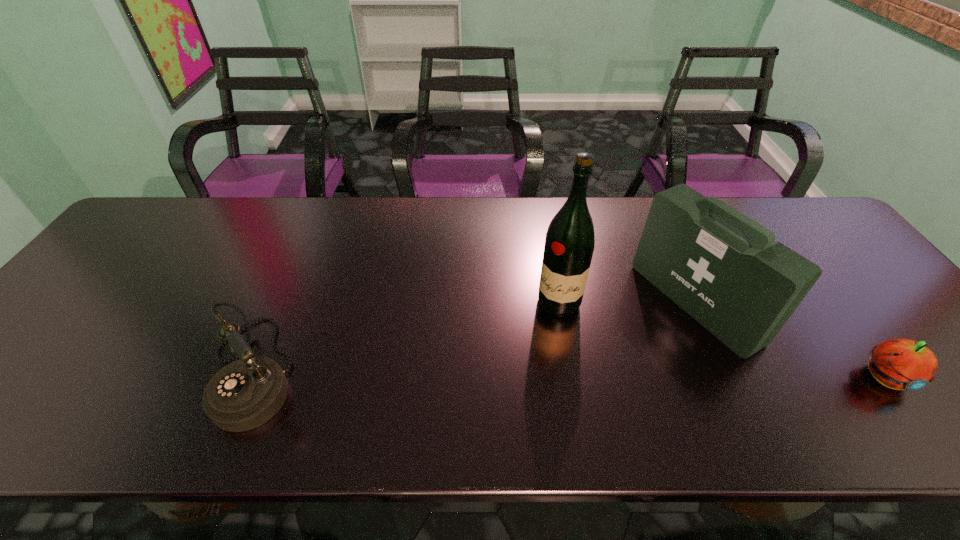
The height and width of the screenshot is (540, 960). Identify the location of vacant spot on the desktop that is between the telephone and the rightmost object and is positioned on the front-facing side of the second object from right to left. (565, 373).

Image resolution: width=960 pixels, height=540 pixels. I want to click on vacant space on the desktop that is between the third tallest object and the apple and is positioned on the front-facing side of the second object from left to right, so click(x=525, y=373).